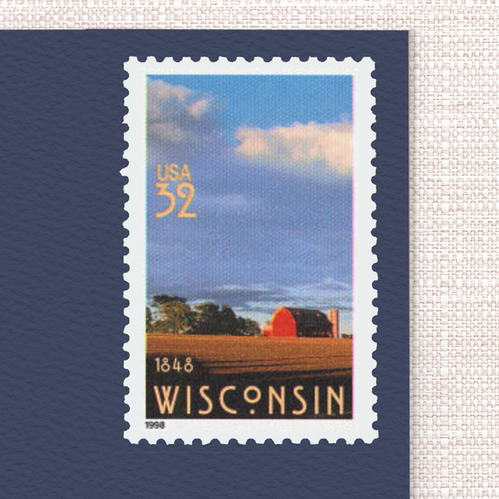
Find the location of a particular element. The height and width of the screenshot is (499, 499). picture design is located at coordinates (258, 308).